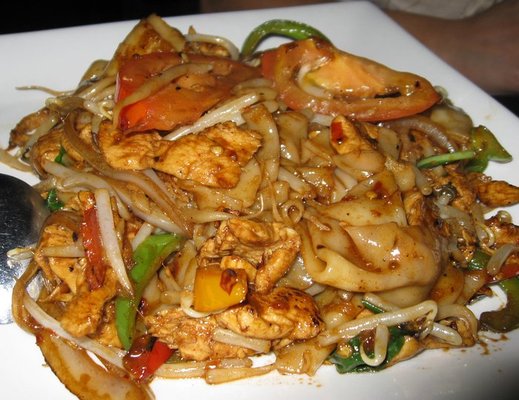
Locate an element on the screen. This screenshot has width=519, height=400. plate is located at coordinates (385, 46).